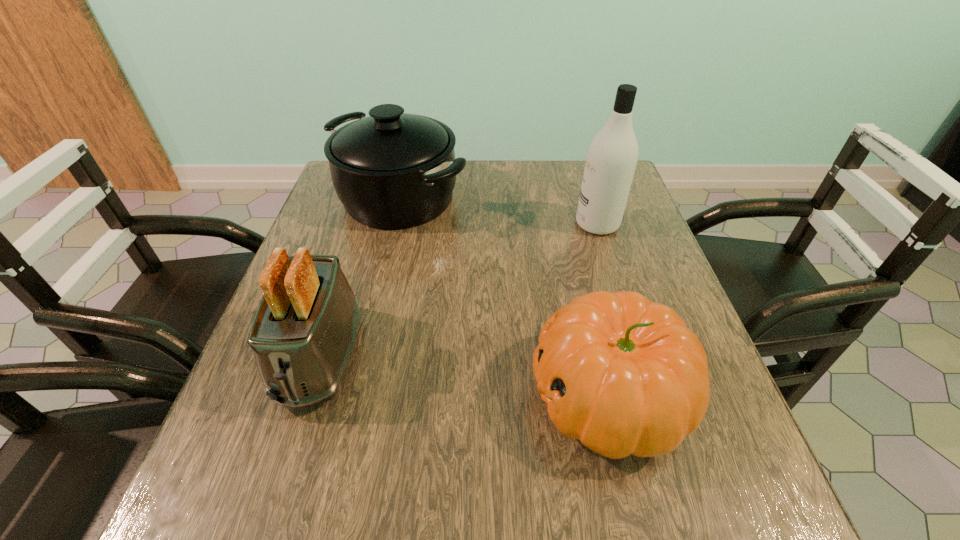
Where is `vacant space at the far edge of the desktop`? This screenshot has width=960, height=540. vacant space at the far edge of the desktop is located at coordinates (528, 190).

This screenshot has width=960, height=540. Identify the location of free space at the near edge of the desktop. (628, 535).

In order to click on free space at the left edge of the desktop in this screenshot , I will do `click(304, 441)`.

Where is `vacant area at the right edge of the desktop`? The width and height of the screenshot is (960, 540). vacant area at the right edge of the desktop is located at coordinates (669, 460).

This screenshot has height=540, width=960. I want to click on blank space at the far left corner, so click(324, 200).

You are a GUI agent. You are given a task and a screenshot of the screen. Output one action in this format:
    pyautogui.click(x=<x>, y=<y>)
    Task: Click on the vacant space at the near right corner of the desktop
    This screenshot has height=540, width=960.
    Given the screenshot: What is the action you would take?
    pyautogui.click(x=717, y=512)

The height and width of the screenshot is (540, 960). In order to click on vacant space that's between the saucepan and the pumpkin in this screenshot , I will do `click(504, 296)`.

You are a GUI agent. You are given a task and a screenshot of the screen. Output one action in this format:
    pyautogui.click(x=<x>, y=<y>)
    Task: Click on the vacant space that is in between the saucepan and the shampoo
    
    Given the screenshot: What is the action you would take?
    pyautogui.click(x=498, y=211)

The height and width of the screenshot is (540, 960). Find the location of `free space between the shampoo and the toaster`. free space between the shampoo and the toaster is located at coordinates (459, 290).

Find the location of a particular element. Image resolution: width=960 pixels, height=540 pixels. free spot between the saucepan and the pumpkin is located at coordinates (504, 296).